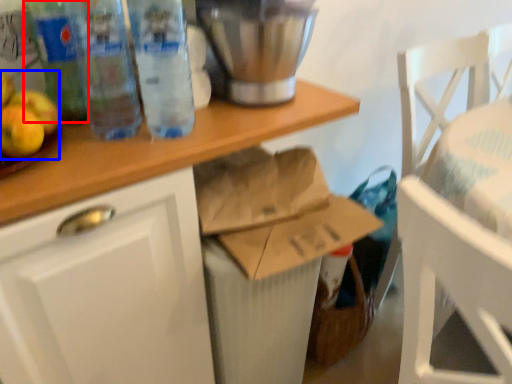
Question: Which point is further to the camera, bottle (highlighted by a red box) or apple (highlighted by a blue box)?

Choices:
 (A) bottle
 (B) apple

Answer: (A)